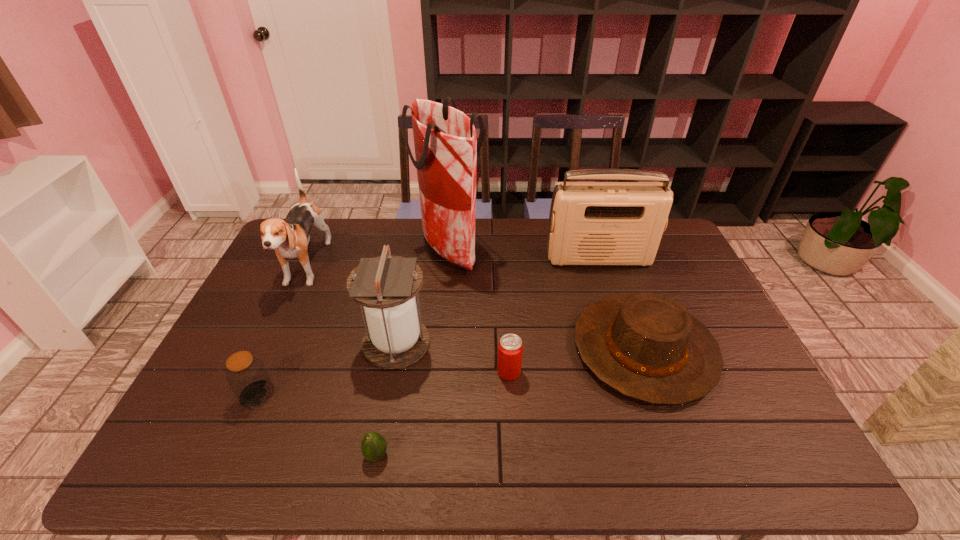
Identify the location of object that is positioned at the near edge. The width and height of the screenshot is (960, 540). (373, 446).

Where is `puppy present at the left edge`? puppy present at the left edge is located at coordinates (290, 238).

I want to click on jar that is at the left edge, so click(x=246, y=374).

This screenshot has height=540, width=960. I want to click on radio receiver present at the right edge, so click(x=591, y=223).

Where is `cowboy hat located at the right edge`? This screenshot has height=540, width=960. cowboy hat located at the right edge is located at coordinates (646, 346).

Locate an element on the screen. Image resolution: width=960 pixels, height=540 pixels. object located at the far left corner is located at coordinates (290, 238).

Locate an element on the screen. Image resolution: width=960 pixels, height=540 pixels. object that is at the far right corner is located at coordinates (591, 223).

I want to click on vacant space at the far edge of the desktop, so click(415, 237).

Identify the location of free space at the near edge of the desktop. (353, 440).

You are a GUI agent. You are given a task and a screenshot of the screen. Output one action in this format:
    pyautogui.click(x=<x>, y=<y>)
    Task: Click on the vacant space at the near left corner
    The height and width of the screenshot is (540, 960).
    Given the screenshot: What is the action you would take?
    pyautogui.click(x=204, y=446)